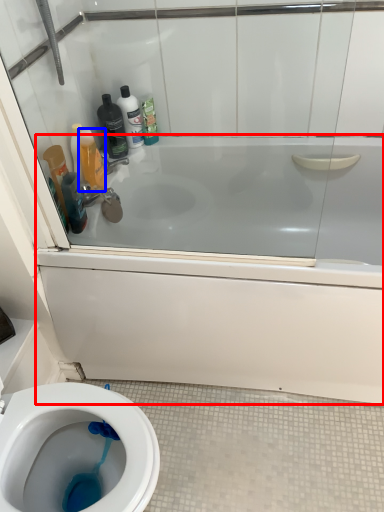
Question: Which object appears farthest to the camera in this image, bath (highlighted by a red box) or cleaning product (highlighted by a blue box)?

Choices:
 (A) bath
 (B) cleaning product

Answer: (B)